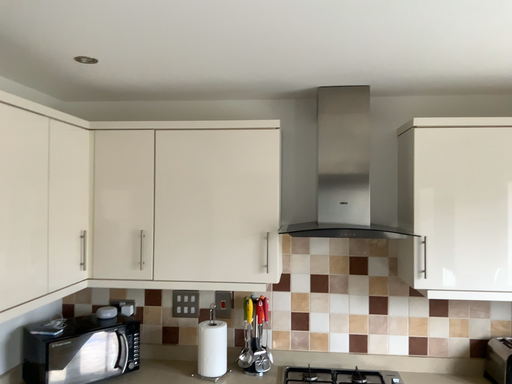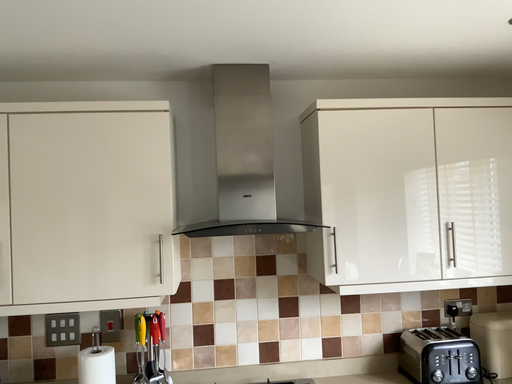
Question: How did the camera likely rotate when shooting the video?

Choices:
 (A) rotated right
 (B) rotated left

Answer: (A)